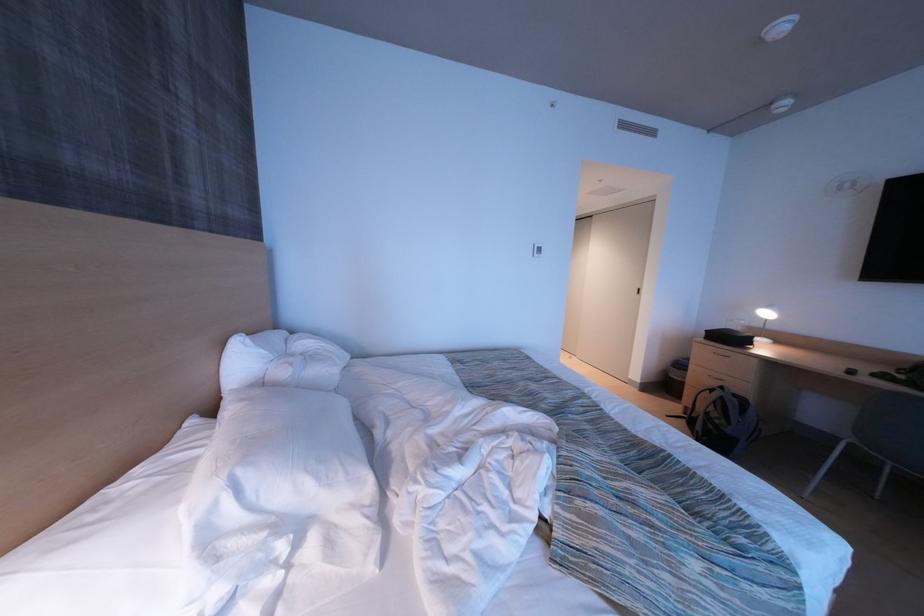
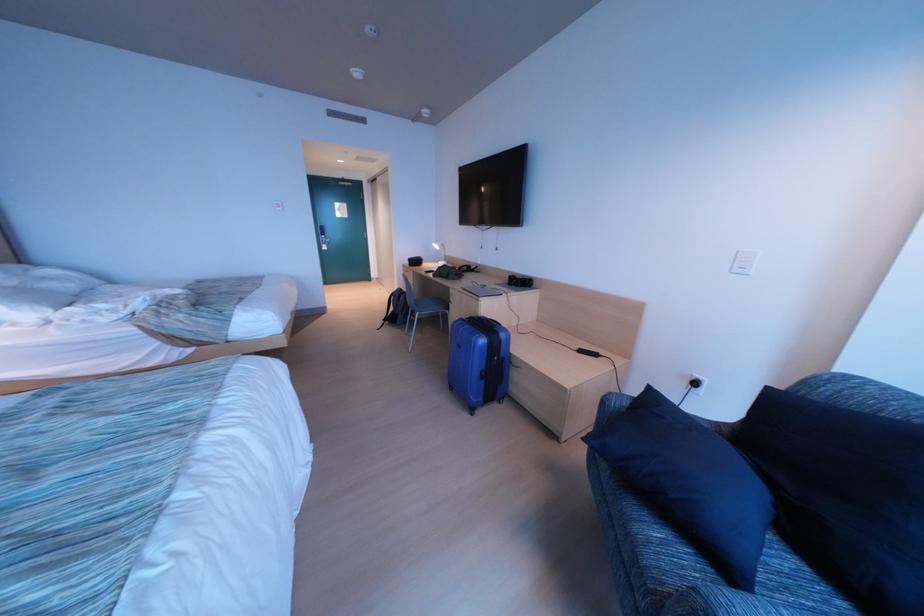
What movement of the cameraman would produce the second image?

The cameraman walked toward right, backward.